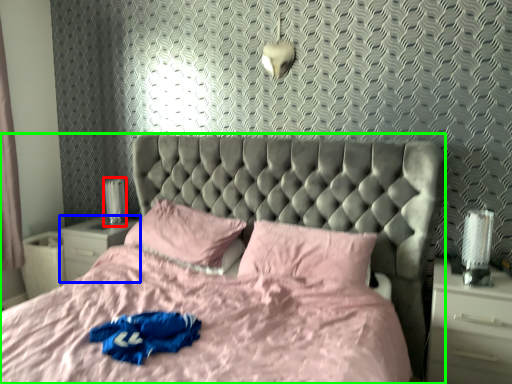
Question: Which object is positioned farthest from table lamp (highlighted by a red box)? Select from nightstand (highlighted by a blue box) and bed (highlighted by a green box).

Choices:
 (A) nightstand
 (B) bed

Answer: (B)